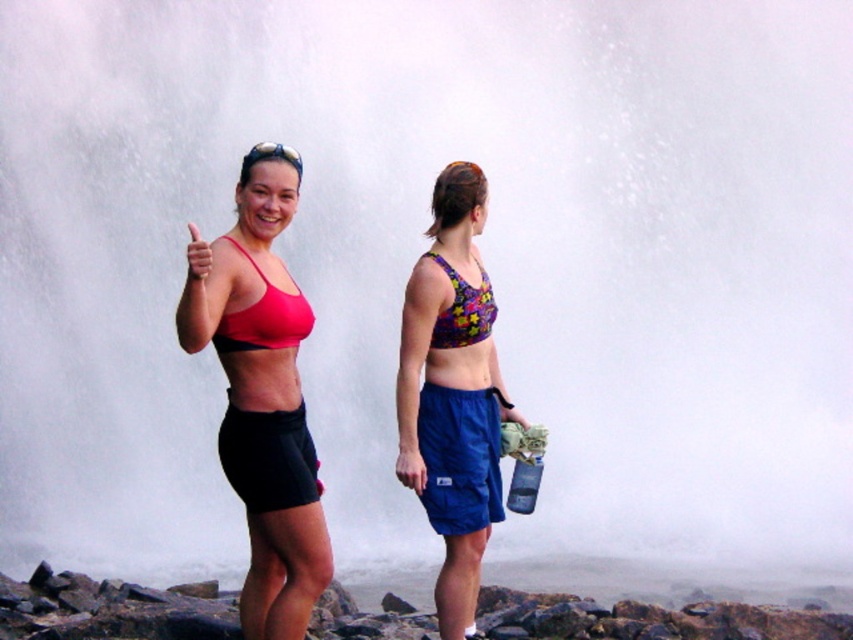
Question: Is matte red sports bra at center to the left of black matte shorts at lower center from the viewer's perspective?

Choices:
 (A) no
 (B) yes

Answer: (B)

Question: From the image, what is the correct spatial relationship of floral fabric sports bra at center in relation to floral fabric bikini top at center?

Choices:
 (A) left
 (B) right

Answer: (B)

Question: Which of the following is the closest to the observer?

Choices:
 (A) 465,205
 (B) 445,333

Answer: (A)

Question: Can you confirm if black matte shorts at lower center is smaller than floral fabric bikini top at center?

Choices:
 (A) yes
 (B) no

Answer: (B)

Question: Which point is closer to the camera?

Choices:
 (A) (236, 461)
 (B) (471, 166)

Answer: (A)

Question: Which object is closer to the camera taking this photo?

Choices:
 (A) floral fabric sports bra at center
 (B) matte red sports bra at center
 (C) black matte shorts at lower center

Answer: (B)